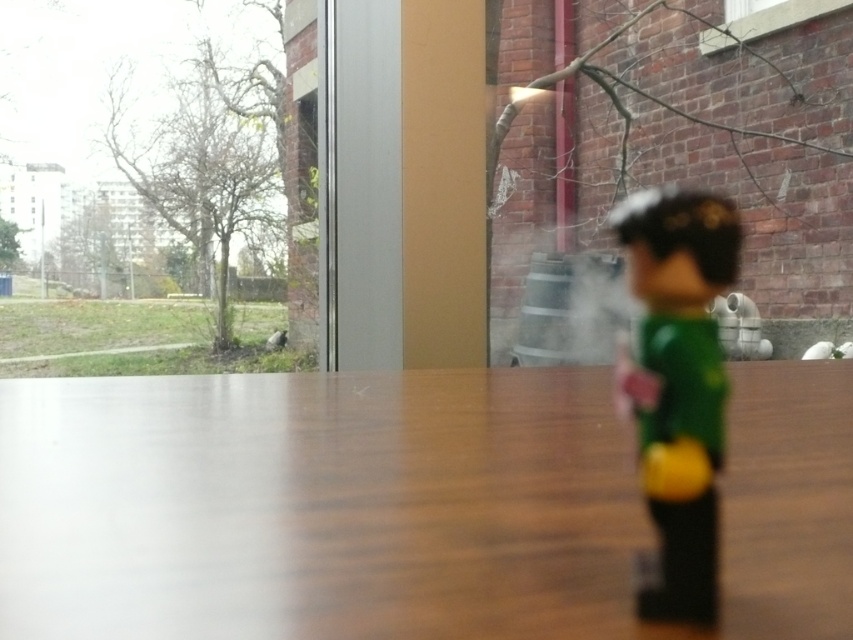
You are a delivery robot that needs to place a package on the wooden table at center. The package is 1 meter in length. Can you safely move the green matte toy at right out of the way to make space for the package?

The wooden table at center is 3.29 meters from the green matte toy at right, so the distance between them is sufficient to move the green matte toy at right out of the way without obstruction. The package should fit on the wooden table at center.

You are standing in a room and want to place a small vase on the wooden table at center. However, there is a green matte toy at right on the table. Can you place the vase there without moving the toy?

The wooden table at center is in front of the green matte toy at right, meaning the toy is not on the table but behind it. Therefore, you can place the vase on the wooden table at center without moving the toy.

You are a photographer adjusting your camera settings to focus on two points in the scene. The first point is at coordinates point (560, 440) and the second is at point (704, 436). Which point should you focus on first if you want to ensure both points are in focus without moving the camera?

You should focus on point (560, 440) first because it is closer to the camera than point (704, 436). By focusing on the closer point, the farther point will also be in focus due to the depth of field.